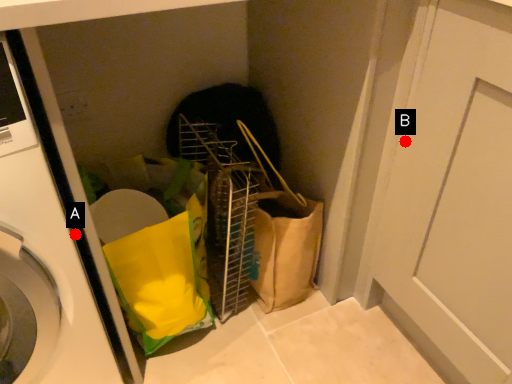
Question: Two points are circled on the image, labeled by A and B beside each circle. Which point is further to the camera?

Choices:
 (A) A is further
 (B) B is further

Answer: (B)